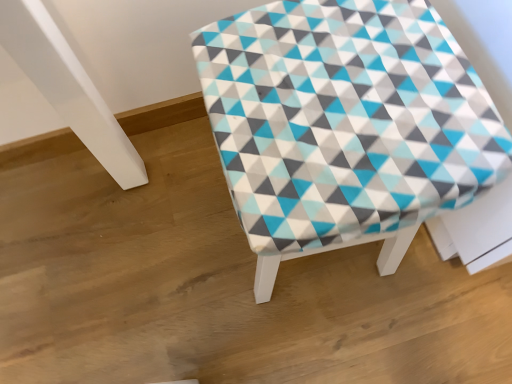
What do you see at coordinates (345, 125) in the screenshot? The width and height of the screenshot is (512, 384). I see `matte fabric stool at center` at bounding box center [345, 125].

Find the location of a particular element. matte fabric stool at center is located at coordinates (345, 125).

Locate an element on the screen. matte fabric stool at center is located at coordinates (345, 125).